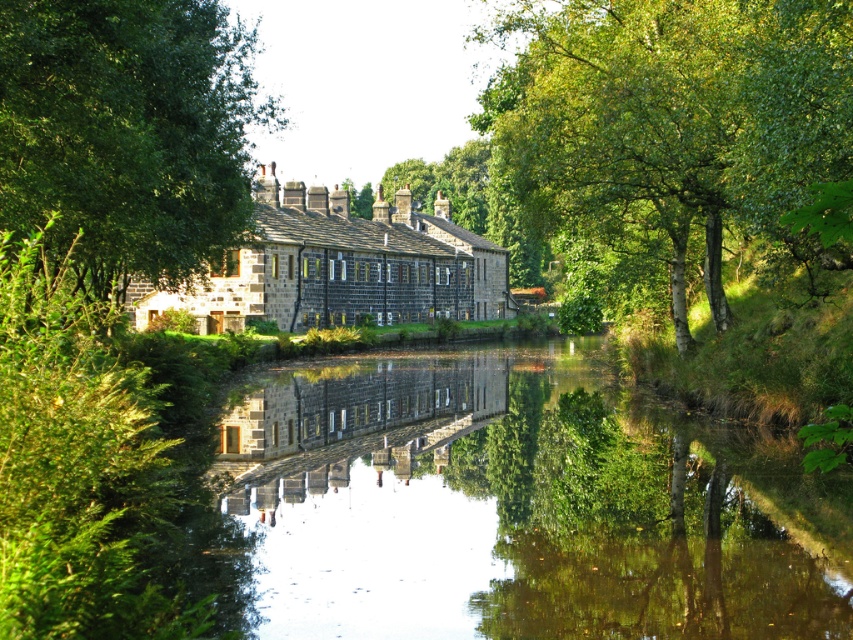
You are standing at the edge of the river in the rural scene and want to find the green leafy tree at upper center. According to the coordinates provided, where should you look relative to your position?

The green leafy tree at upper center is located at coordinates point (672, 115), which means it is positioned slightly to the left and above your current viewpoint along the river.

You are standing on the bank of the river and want to take a photo of the green leafy tree at upper center and the smooth reflective water at center. Which object is closer to the camera?

The green leafy tree at upper center is closer to the camera because the smooth reflective water at center is positioned under it, meaning the tree is above the water in the scene.